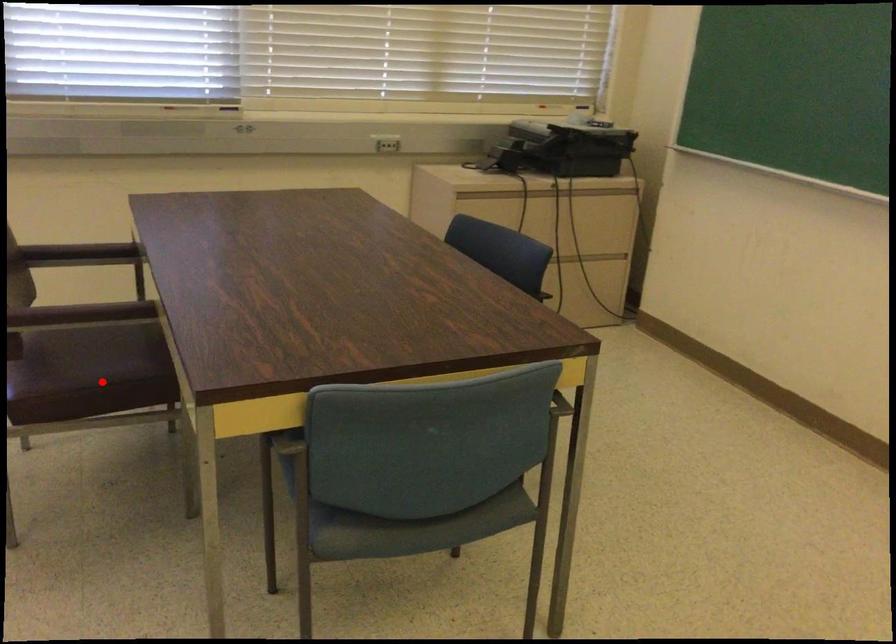
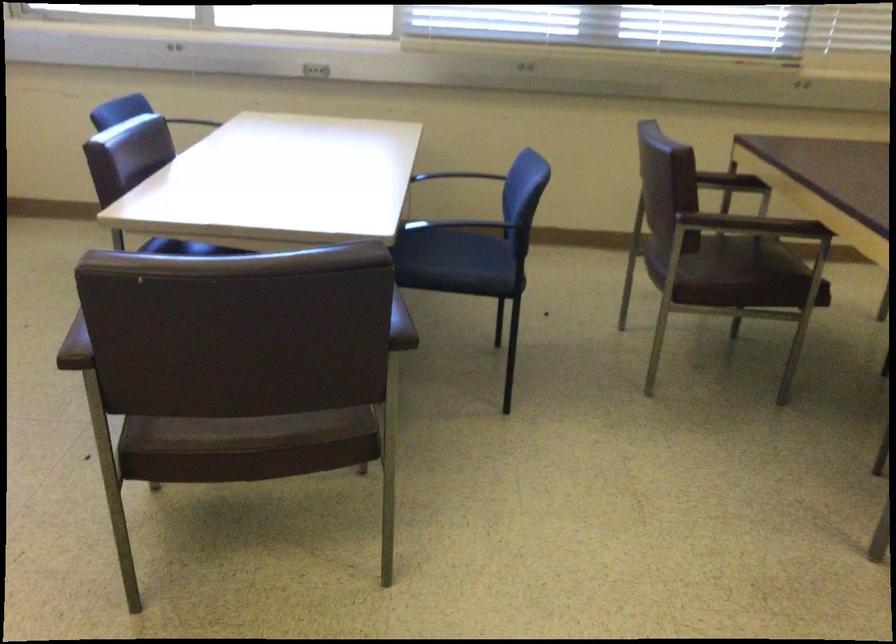
Locate, in the second image, the point that corresponds to the highlighted location in the first image.

(739, 278)